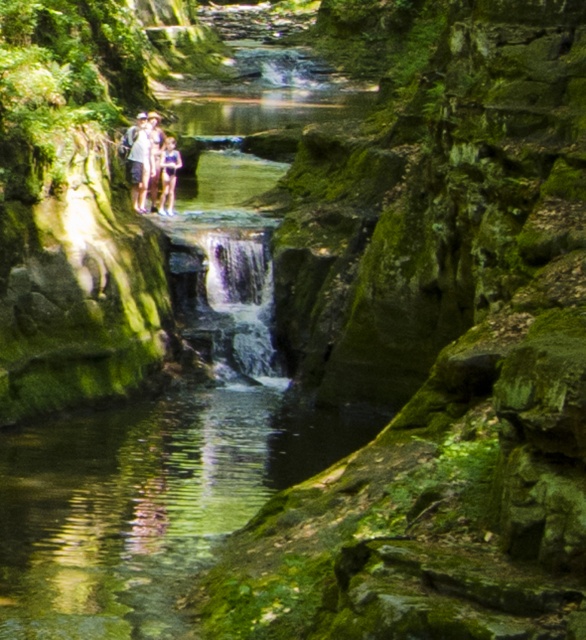
You are a hiker planning to cross the shallow stream in the canyon. You see the light brown wooden couple at center and the blue denim shorts at center. Which object should you step on to avoid getting your feet wet?

You should step on the light brown wooden couple at center because it is located above the blue denim shorts at center, which is likely near the water.

You are a hiker trying to cross the shallow stream. You see the light brown wooden couple at center and the blue denim shorts at center. Which object should you step on to cross the stream safely?

The light brown wooden couple at center is to the left of blue denim shorts at center. Since wooden surfaces are more stable than rocky or mossy surfaces, stepping on the light brown wooden couple at center would provide a safer crossing.

You are a hiker planning to cross the shallow stream in the foreground. There is a light brown wooden couple at center represented by point (142, 157). Can you safely cross the stream at that point?

The light brown wooden couple at center is represented by point (142, 157). The shallow stream in the foreground has gentle ripples and is relatively still, so it should be safe to cross at that point.